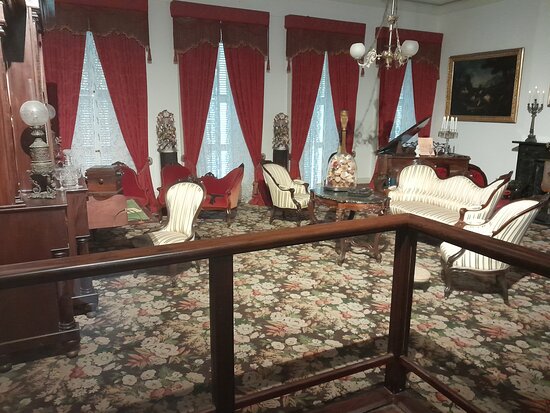
The image size is (550, 413). In order to click on candles in this screenshot , I will do `click(444, 124)`, `click(448, 124)`, `click(452, 124)`, `click(530, 92)`, `click(539, 92)`.